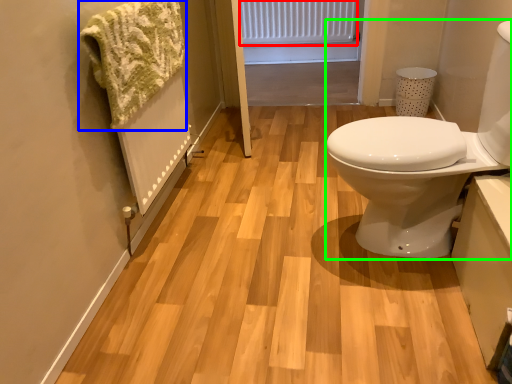
Question: Which object is the closest to the radiator (highlighted by a red box)? Choose among these: bath towel (highlighted by a blue box) or sink (highlighted by a green box).

Choices:
 (A) bath towel
 (B) sink

Answer: (A)